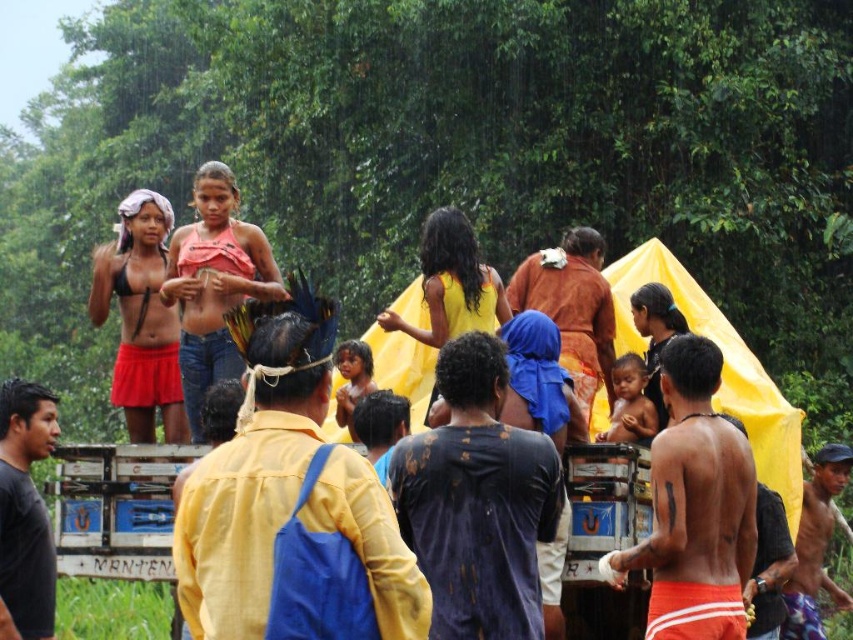
Question: Which object is the farthest from the shiny metallic bracelet at lower right?

Choices:
 (A) brown woven cloth at center
 (B) dark blue fabric shirt at center

Answer: (B)

Question: Where is black matte shirt at left located in relation to smooth skin baby at center in the image?

Choices:
 (A) left
 (B) right

Answer: (A)

Question: Does smooth skin baby at center come in front of dark skin child at center?

Choices:
 (A) no
 (B) yes

Answer: (B)

Question: Which point appears farthest from the camera in this image?

Choices:
 (A) (804, 556)
 (B) (341, 403)
 (C) (628, 406)
 (D) (0, 397)

Answer: (A)

Question: Is dark blue fabric shirt at center positioned before brown woven cloth at center?

Choices:
 (A) yes
 (B) no

Answer: (A)

Question: Which object is farther from the camera taking this photo?

Choices:
 (A) shiny orange shorts at center-right
 (B) yellow fabric shirt at center
 (C) dark skin child at center

Answer: (C)